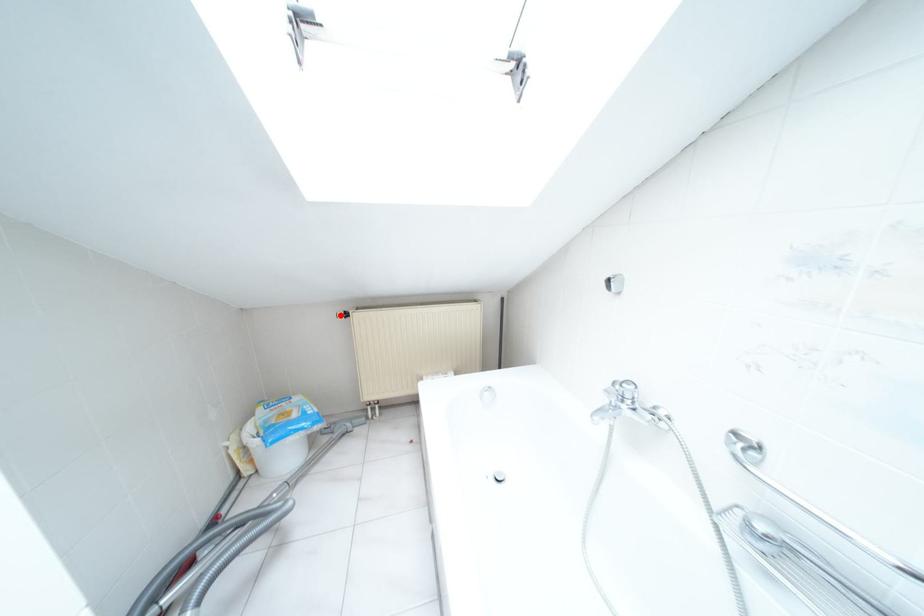
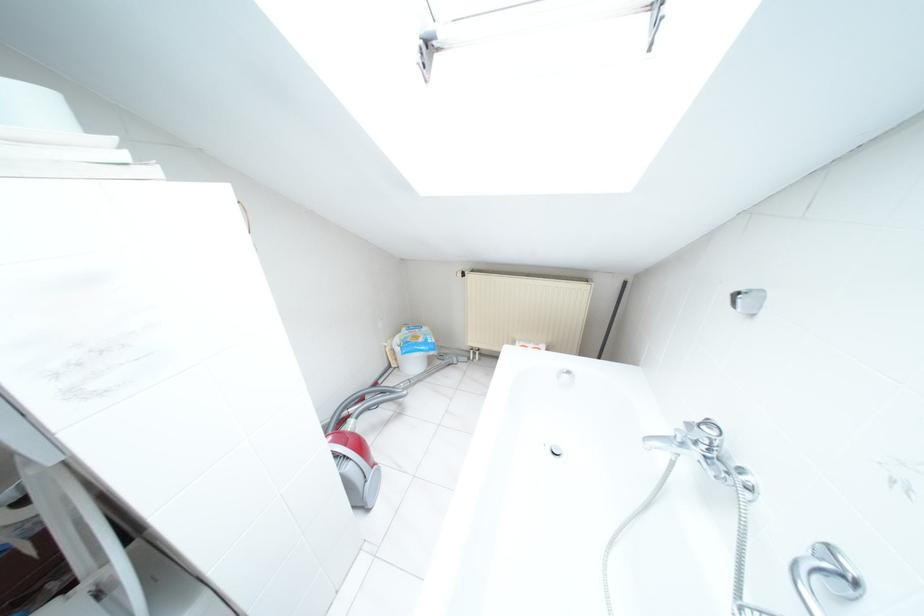
Find the pixel in the second image that matches the highlighted location in the first image.

(458, 274)